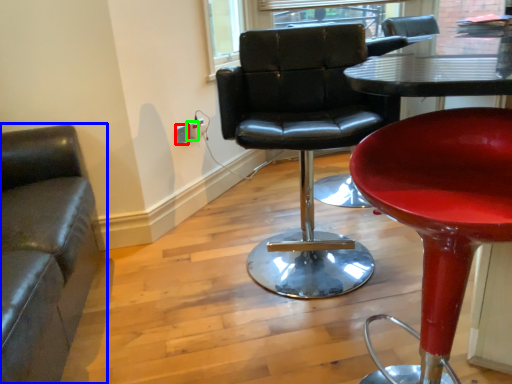
Question: Which is nearer to the electric outlet (highlighted by a red box)? chair (highlighted by a blue box) or electric outlet (highlighted by a green box).

Choices:
 (A) chair
 (B) electric outlet

Answer: (B)